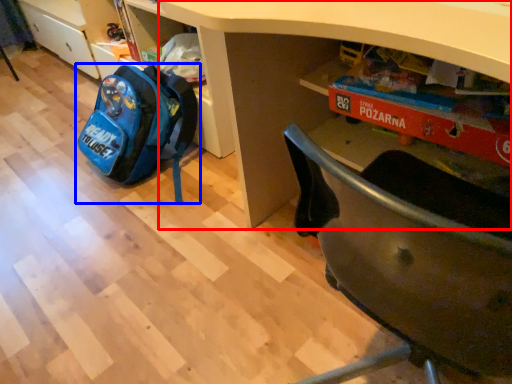
Question: Which object appears closest to the camera in this image, desk (highlighted by a red box) or backpack (highlighted by a blue box)?

Choices:
 (A) desk
 (B) backpack

Answer: (A)